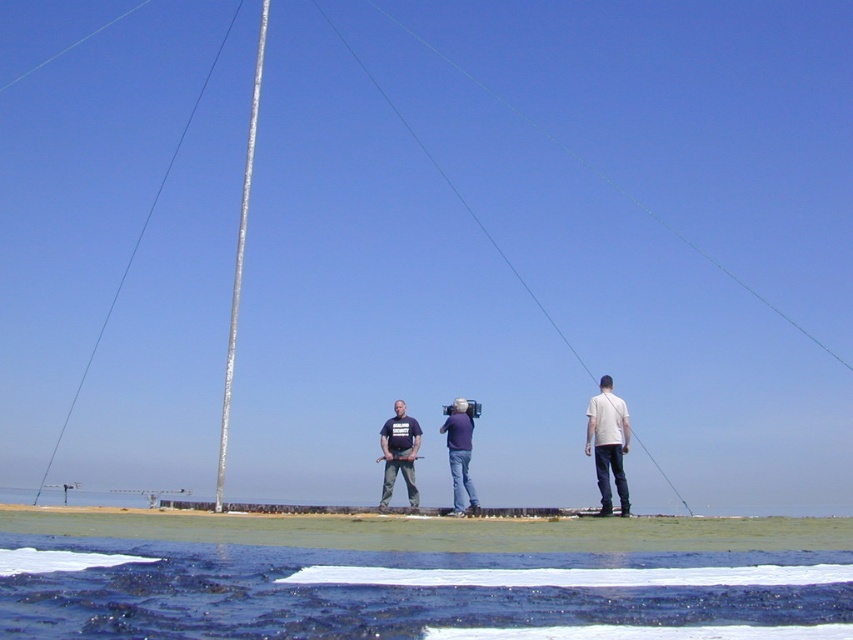
You are standing on the wooden platform at the seaside and notice the white matte shirt at center. Based on its coordinates, can you determine if it is positioned closer to the front or the back of the platform?

The white matte shirt at center is located at point 0.695 on the x and 0.714 on the y axis, which places it closer to the back of the platform since higher y values typically indicate rear positions in such coordinate systems.